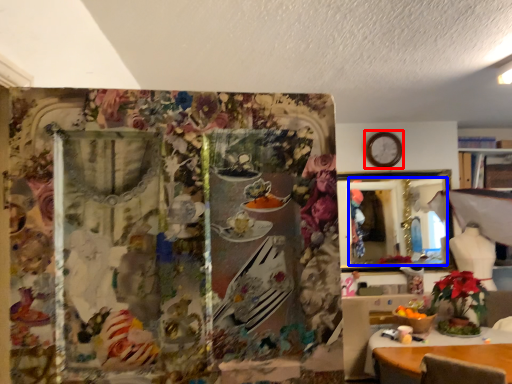
Question: Which object appears farthest to the camera in this image, clock (highlighted by a red box) or mirror (highlighted by a blue box)?

Choices:
 (A) clock
 (B) mirror

Answer: (A)